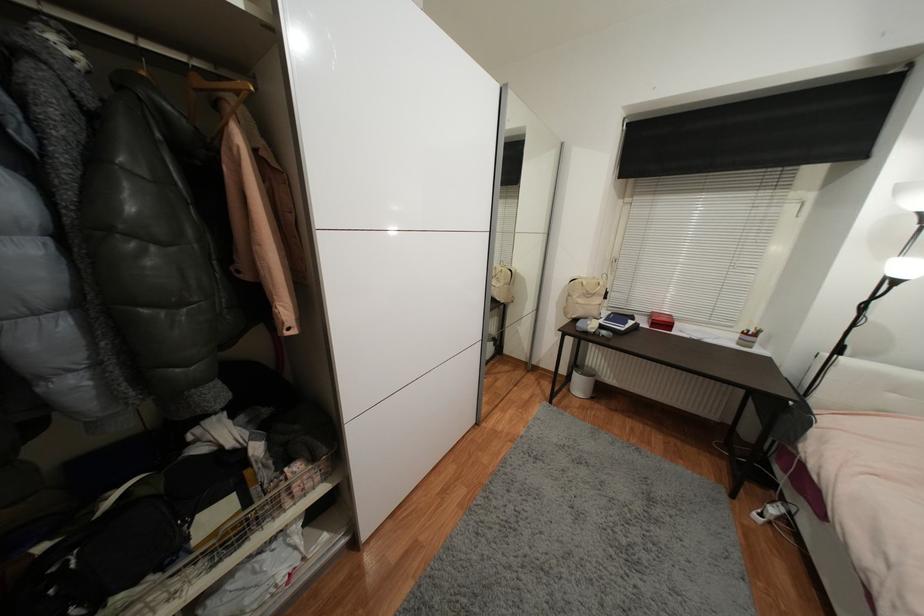
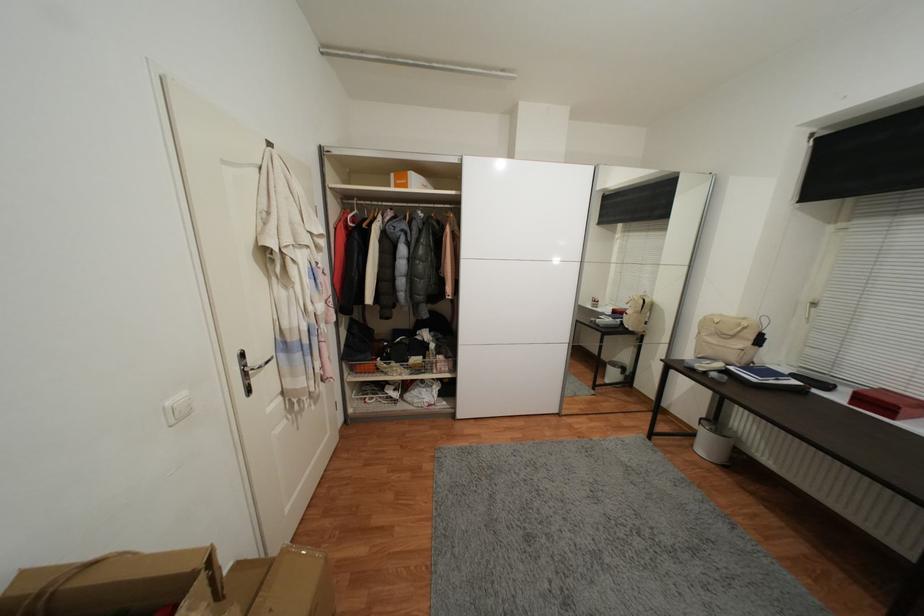
In the second image, find the point that corresponds to (x=626, y=330) in the first image.

(759, 381)